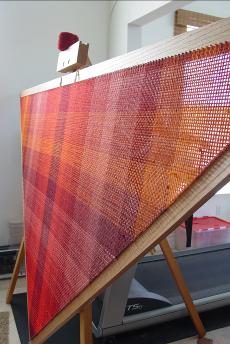
I want to click on translucent plastic bin, so click(x=208, y=240).